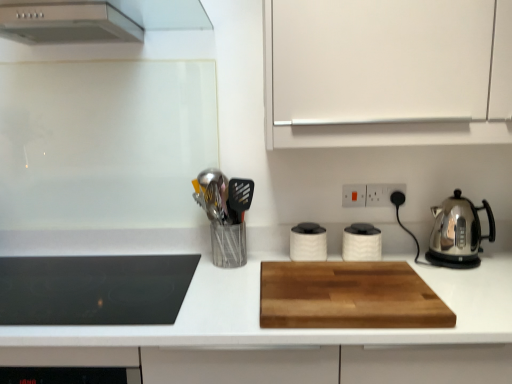
Question: Does wooden cutting board at center have a larger size compared to white plastic electric outlet at upper center, which is the second electric outlet in right-to-left order?

Choices:
 (A) yes
 (B) no

Answer: (A)

Question: Is wooden cutting board at center oriented away from white plastic electric outlet at upper center, positioned as the first electric outlet in left-to-right order?

Choices:
 (A) no
 (B) yes

Answer: (A)

Question: Could you tell me if wooden cutting board at center is facing white plastic electric outlet at upper center, which is the second electric outlet in right-to-left order?

Choices:
 (A) no
 (B) yes

Answer: (A)

Question: Is the position of wooden cutting board at center less distant than that of white plastic electric outlet at upper center, which is the second electric outlet in right-to-left order?

Choices:
 (A) yes
 (B) no

Answer: (A)

Question: From a real-world perspective, is wooden cutting board at center located higher than white plastic electric outlet at upper center, which is the second electric outlet in right-to-left order?

Choices:
 (A) no
 (B) yes

Answer: (A)

Question: Would you say stainless steel kettle at right, the 4th kitchen appliance viewed from the left, is to the left or to the right of wooden cutting board at center in the picture?

Choices:
 (A) right
 (B) left

Answer: (A)

Question: From the image's perspective, relative to wooden cutting board at center, is stainless steel kettle at right, the 4th kitchen appliance viewed from the left, above or below?

Choices:
 (A) below
 (B) above

Answer: (B)

Question: Would you say stainless steel kettle at right, the 4th kitchen appliance viewed from the left, is inside or outside wooden cutting board at center?

Choices:
 (A) inside
 (B) outside

Answer: (B)

Question: Considering the positions of stainless steel kettle at right, the first kitchen appliance positioned from the right, and wooden cutting board at center in the image, is stainless steel kettle at right, the first kitchen appliance positioned from the right, wider or thinner than wooden cutting board at center?

Choices:
 (A) thin
 (B) wide

Answer: (A)

Question: Considering their positions, is metallic silver utensil holder at center-left located in front of or behind white matte cabinet at upper right?

Choices:
 (A) behind
 (B) front

Answer: (A)

Question: Is point (205, 208) positioned closer to the camera than point (323, 89)?

Choices:
 (A) closer
 (B) farther

Answer: (B)

Question: Is metallic silver utensil holder at center-left taller or shorter than white matte cabinet at upper right?

Choices:
 (A) short
 (B) tall

Answer: (A)

Question: Looking at their shapes, would you say metallic silver utensil holder at center-left is wider or thinner than white matte cabinet at upper right?

Choices:
 (A) wide
 (B) thin

Answer: (B)

Question: Would you say stainless steel kettle at right, the first kitchen appliance positioned from the right, is inside or outside white matte canister at center, which appears as the 3th kitchen appliance when viewed from the right?

Choices:
 (A) outside
 (B) inside

Answer: (A)

Question: Is stainless steel kettle at right, the first kitchen appliance positioned from the right, wider or thinner than white matte canister at center, which is counted as the second kitchen appliance, starting from the left?

Choices:
 (A) thin
 (B) wide

Answer: (B)